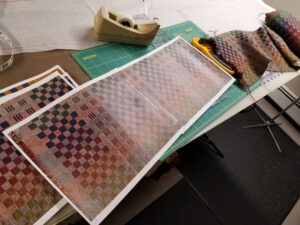
Identify the location of tape dispenser. (120, 21).